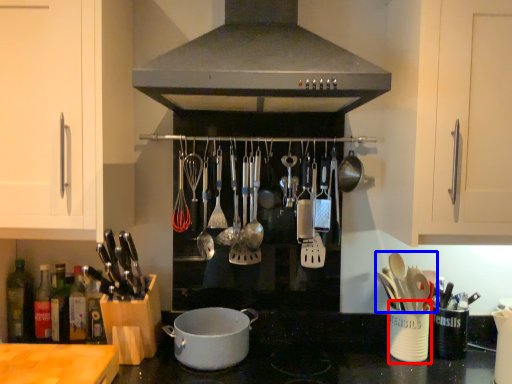
Question: Which of the following is the farthest to the observer, appliance (highlighted by a red box) or silverware (highlighted by a blue box)?

Choices:
 (A) appliance
 (B) silverware

Answer: (A)